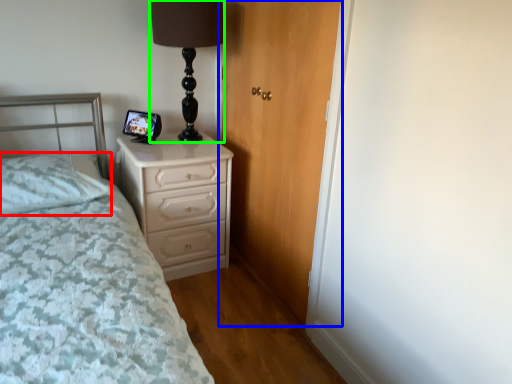
Question: Which object is positioned closest to pillow (highlighted by a red box)? Select from door (highlighted by a blue box) and table lamp (highlighted by a green box).

Choices:
 (A) door
 (B) table lamp

Answer: (B)